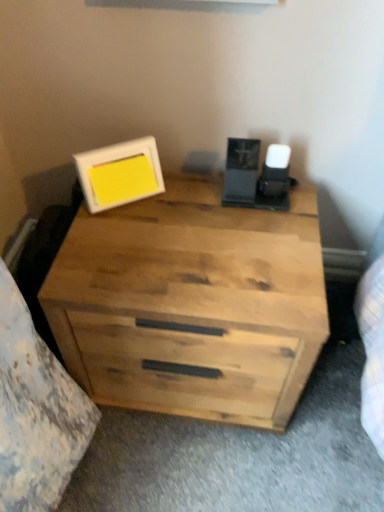
The image size is (384, 512). Describe the element at coordinates (119, 173) in the screenshot. I see `white matte picture frame at upper left` at that location.

Image resolution: width=384 pixels, height=512 pixels. Identify the location of white matte picture frame at upper left. (119, 173).

Describe the element at coordinates (192, 304) in the screenshot. This screenshot has width=384, height=512. I see `natural wood chest of drawers at center` at that location.

Find the location of a particular element. This screenshot has height=512, width=384. natural wood chest of drawers at center is located at coordinates (192, 304).

Identify the location of white matte picture frame at upper left. This screenshot has width=384, height=512. (119, 173).

Is white matte picture frame at upper left at the right side of natural wood chest of drawers at center?

Incorrect, white matte picture frame at upper left is not on the right side of natural wood chest of drawers at center.

Who is more distant, white matte picture frame at upper left or natural wood chest of drawers at center?

white matte picture frame at upper left is further from the camera.

Which is behind, point (106, 206) or point (221, 396)?

The point (221, 396) is behind.

From the image's perspective, which one is positioned lower, white matte picture frame at upper left or natural wood chest of drawers at center?

natural wood chest of drawers at center.

From a real-world perspective, which is physically below, white matte picture frame at upper left or natural wood chest of drawers at center?

natural wood chest of drawers at center is physically lower.

Considering the sizes of objects white matte picture frame at upper left and natural wood chest of drawers at center in the image provided, who is thinner, white matte picture frame at upper left or natural wood chest of drawers at center?

Thinner between the two is white matte picture frame at upper left.

Is white matte picture frame at upper left taller than natural wood chest of drawers at center?

No, white matte picture frame at upper left is not taller than natural wood chest of drawers at center.

Based on their sizes in the image, would you say white matte picture frame at upper left is bigger or smaller than natural wood chest of drawers at center?

white matte picture frame at upper left is smaller than natural wood chest of drawers at center.

Can natural wood chest of drawers at center be found inside white matte picture frame at upper left?

No, natural wood chest of drawers at center is not inside white matte picture frame at upper left.

Is white matte picture frame at upper left positioned far away from natural wood chest of drawers at center?

They are positioned close to each other.

Does white matte picture frame at upper left turn towards natural wood chest of drawers at center?

No, white matte picture frame at upper left is not aimed at natural wood chest of drawers at center.

Image resolution: width=384 pixels, height=512 pixels. I want to click on the chest of drawers that is in front of the white matte picture frame at upper left, so click(192, 304).

Between natural wood chest of drawers at center and white matte picture frame at upper left, which one appears on the right side from the viewer's perspective?

natural wood chest of drawers at center.

Which object is closer to the camera, natural wood chest of drawers at center or white matte picture frame at upper left?

natural wood chest of drawers at center is in front.

Between point (210, 199) and point (133, 169), which one is positioned behind?

The point (210, 199) is behind.

From the image's perspective, is natural wood chest of drawers at center on white matte picture frame at upper left?

Actually, natural wood chest of drawers at center appears below white matte picture frame at upper left in the image.

From a real-world perspective, who is located higher, natural wood chest of drawers at center or white matte picture frame at upper left?

In real-world perspective, white matte picture frame at upper left is above.

Considering the sizes of objects natural wood chest of drawers at center and white matte picture frame at upper left in the image provided, who is wider, natural wood chest of drawers at center or white matte picture frame at upper left?

natural wood chest of drawers at center is wider.

Considering the relative sizes of natural wood chest of drawers at center and white matte picture frame at upper left in the image provided, is natural wood chest of drawers at center shorter than white matte picture frame at upper left?

Incorrect, the height of natural wood chest of drawers at center does not fall short of that of white matte picture frame at upper left.

Considering the sizes of objects natural wood chest of drawers at center and white matte picture frame at upper left in the image provided, who is smaller, natural wood chest of drawers at center or white matte picture frame at upper left?

Smaller between the two is white matte picture frame at upper left.

Would you say natural wood chest of drawers at center contains white matte picture frame at upper left?

Actually, white matte picture frame at upper left is outside natural wood chest of drawers at center.

Is natural wood chest of drawers at center far away from white matte picture frame at upper left?

No, natural wood chest of drawers at center is not far from white matte picture frame at upper left.

Could you tell me if natural wood chest of drawers at center is facing white matte picture frame at upper left?

No, natural wood chest of drawers at center is not oriented towards white matte picture frame at upper left.

Can you tell me how much natural wood chest of drawers at center and white matte picture frame at upper left differ in facing direction?

There is a 33.8-degree angle between the facing directions of natural wood chest of drawers at center and white matte picture frame at upper left.

At what (x,y) coordinates should I click in order to perform the action: click on picture frame located on the left of natural wood chest of drawers at center. Please return your answer as a coordinate pair (x, y). This screenshot has width=384, height=512. Looking at the image, I should click on (119, 173).

The image size is (384, 512). In the image, there is a natural wood chest of drawers at center. What are the coordinates of `picture frame above it (from the image's perspective)` in the screenshot? It's located at (119, 173).

Find the location of a particular element. picture frame on the left of the natural wood chest of drawers at center is located at coordinates (119, 173).